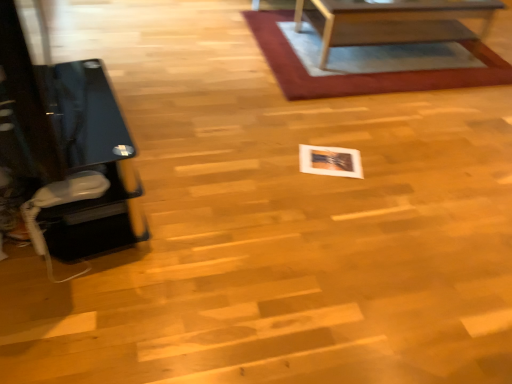
Image resolution: width=512 pixels, height=384 pixels. I want to click on vacant area that is situated to the right of white glossy photo frame at center, so click(x=374, y=166).